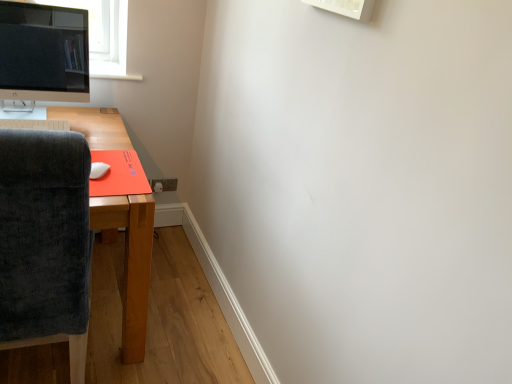
Measure the distance between point [73,90] and camera.

The depth of point [73,90] is 5.97 feet.

What is the approximate width of brown plastic power outlet at lower center?

It is 0.45 inches.

In order to click on white plastic keyboard at lower left in this screenshot , I will do `click(35, 124)`.

This screenshot has width=512, height=384. In order to click on dark gray fabric chair at left in this screenshot , I will do `click(45, 241)`.

Is dark gray fabric chair at left further to camera compared to white plastic keyboard at lower left?

No, the depth of dark gray fabric chair at left is less than that of white plastic keyboard at lower left.

Is dark gray fabric chair at left far away from white plastic keyboard at lower left?

dark gray fabric chair at left is actually quite close to white plastic keyboard at lower left.

Does point (36, 195) come in front of point (36, 128)?

No, it is not.

Which of these two, dark gray fabric chair at left or white plastic keyboard at lower left, is bigger?

dark gray fabric chair at left is bigger.

Can you tell me how much dark gray fabric chair at left and white matte mouse at lower left differ in facing direction?

The angular difference between dark gray fabric chair at left and white matte mouse at lower left is 29.2 degrees.

Consider the image. Considering the relative positions of dark gray fabric chair at left and white matte mouse at lower left in the image provided, is dark gray fabric chair at left behind white matte mouse at lower left?

No, dark gray fabric chair at left is closer to the camera.

Would you say dark gray fabric chair at left is inside or outside white matte mouse at lower left?

dark gray fabric chair at left is located beyond the bounds of white matte mouse at lower left.

Is dark gray fabric chair at left at the left side of white matte mouse at lower left?

Yes, dark gray fabric chair at left is to the left of white matte mouse at lower left.

Between white matte mouse at lower left and satin black monitor at upper left, which one has smaller size?

Smaller between the two is white matte mouse at lower left.

Which object is closer to the camera taking this photo, white matte mouse at lower left or satin black monitor at upper left?

white matte mouse at lower left.

Who is shorter, white matte mouse at lower left or satin black monitor at upper left?

With less height is white matte mouse at lower left.

Does white matte mouse at lower left touch dark gray fabric chair at left?

There is a gap between white matte mouse at lower left and dark gray fabric chair at left.

From a real-world perspective, is white matte mouse at lower left physically above dark gray fabric chair at left?

Yes.

From the image's perspective, does white matte mouse at lower left appear higher than dark gray fabric chair at left?

Yes, from the image's perspective, white matte mouse at lower left is above dark gray fabric chair at left.

Considering the relative sizes of white matte mouse at lower left and dark gray fabric chair at left in the image provided, is white matte mouse at lower left smaller than dark gray fabric chair at left?

Yes, white matte mouse at lower left is smaller than dark gray fabric chair at left.

Can you tell me how much brown plastic power outlet at lower center and white plastic keyboard at lower left differ in facing direction?

1.52 degrees.

The width and height of the screenshot is (512, 384). Identify the location of desktop located in front of the brown plastic power outlet at lower center. (35, 124).

Would you say brown plastic power outlet at lower center is to the left or to the right of white plastic keyboard at lower left in the picture?

From the image, it's evident that brown plastic power outlet at lower center is to the right of white plastic keyboard at lower left.

From the image's perspective, which one is positioned higher, brown plastic power outlet at lower center or white plastic keyboard at lower left?

white plastic keyboard at lower left is shown above in the image.

Does point (160, 190) come behind point (93, 162)?

Yes, it is behind point (93, 162).

Is brown plastic power outlet at lower center at the left side of white matte mouse at lower left?

Incorrect, brown plastic power outlet at lower center is not on the left side of white matte mouse at lower left.

From the picture: From a real-world perspective, is brown plastic power outlet at lower center physically located above or below white matte mouse at lower left?

In terms of real-world spatial position, brown plastic power outlet at lower center is below white matte mouse at lower left.

Is white matte mouse at lower left at the back of brown plastic power outlet at lower center?

No, brown plastic power outlet at lower center is not facing the opposite direction of white matte mouse at lower left.

Visually, is white plastic keyboard at lower left positioned to the left or to the right of dark gray fabric chair at left?

Based on their positions, white plastic keyboard at lower left is located to the left of dark gray fabric chair at left.

Does white plastic keyboard at lower left have a larger size compared to dark gray fabric chair at left?

No.

From a real-world perspective, who is located higher, white plastic keyboard at lower left or dark gray fabric chair at left?

white plastic keyboard at lower left.

Find the location of a particular element. desktop located above the dark gray fabric chair at left (from a real-world perspective) is located at coordinates (35, 124).

The height and width of the screenshot is (384, 512). I want to click on chair below the white plastic keyboard at lower left (from the image's perspective), so click(x=45, y=241).

This screenshot has width=512, height=384. Identify the location of chair beneath the white matte mouse at lower left (from a real-world perspective). (45, 241).

Based on their spatial positions, is dark gray fabric chair at left or brown plastic power outlet at lower center closer to white matte mouse at lower left?

Among the two, dark gray fabric chair at left is located nearer to white matte mouse at lower left.

Estimate the real-world distances between objects in this image. Which object is closer to white matte mouse at lower left, brown plastic power outlet at lower center or white plastic keyboard at lower left?

Among the two, white plastic keyboard at lower left is located nearer to white matte mouse at lower left.

Which object lies nearer to the anchor point satin black monitor at upper left, brown plastic power outlet at lower center or white matte mouse at lower left?

Based on the image, white matte mouse at lower left appears to be nearer to satin black monitor at upper left.

From the image, which object appears to be farther from white plastic keyboard at lower left, satin black monitor at upper left or dark gray fabric chair at left?

satin black monitor at upper left is further to white plastic keyboard at lower left.

When comparing their distances from satin black monitor at upper left, does dark gray fabric chair at left or white plastic keyboard at lower left seem closer?

white plastic keyboard at lower left.

From the image, which object appears to be nearer to brown plastic power outlet at lower center, white matte mouse at lower left or satin black monitor at upper left?

satin black monitor at upper left.

Which object lies further to the anchor point satin black monitor at upper left, white plastic keyboard at lower left or dark gray fabric chair at left?

dark gray fabric chair at left.

From the image, which object appears to be farther from brown plastic power outlet at lower center, satin black monitor at upper left or white matte mouse at lower left?

white matte mouse at lower left is positioned further to the anchor brown plastic power outlet at lower center.

At what (x,y) coordinates should I click in order to perform the action: click on desktop between dark gray fabric chair at left and satin black monitor at upper left along the z-axis. Please return your answer as a coordinate pair (x, y). Looking at the image, I should click on (35, 124).

Identify the location of desktop between white matte mouse at lower left and brown plastic power outlet at lower center in the front-back direction. (35, 124).

You are a GUI agent. You are given a task and a screenshot of the screen. Output one action in this format:
    pyautogui.click(x=<x>, y=<y>)
    Task: Click on the mouse between dark gray fabric chair at left and brown plastic power outlet at lower center in the front-back direction
    
    Given the screenshot: What is the action you would take?
    pyautogui.click(x=98, y=170)

This screenshot has width=512, height=384. I want to click on desktop between satin black monitor at upper left and white matte mouse at lower left from top to bottom, so click(35, 124).